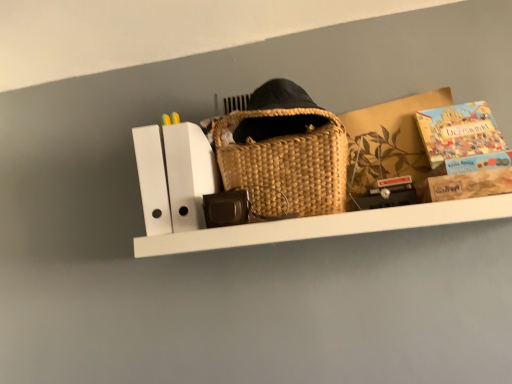
Question: Is point (424, 168) closer or farther from the camera than point (464, 114)?

Choices:
 (A) farther
 (B) closer

Answer: (B)

Question: In terms of height, does brown cardboard box at upper right look taller or shorter compared to matte cardboard book at upper right?

Choices:
 (A) short
 (B) tall

Answer: (B)

Question: Is brown cardboard box at upper right wider or thinner than matte cardboard book at upper right?

Choices:
 (A) thin
 (B) wide

Answer: (B)

Question: From the image's perspective, is matte cardboard book at upper right positioned above or below brown cardboard box at upper right?

Choices:
 (A) above
 (B) below

Answer: (A)

Question: Do you think matte cardboard book at upper right is within brown cardboard box at upper right, or outside of it?

Choices:
 (A) inside
 (B) outside

Answer: (A)

Question: Considering the positions of matte cardboard book at upper right and brown cardboard box at upper right in the image, is matte cardboard book at upper right wider or thinner than brown cardboard box at upper right?

Choices:
 (A) wide
 (B) thin

Answer: (B)

Question: Considering the positions of matte cardboard book at upper right and brown cardboard box at upper right in the image, is matte cardboard book at upper right bigger or smaller than brown cardboard box at upper right?

Choices:
 (A) big
 (B) small

Answer: (B)